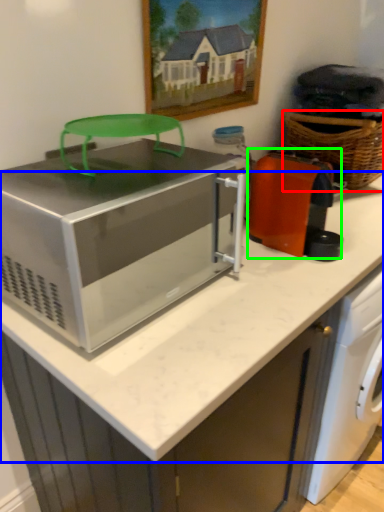
Question: Considering the real-world distances, which object is closest to basket (highlighted by a red box)? counter top (highlighted by a blue box) or appliance (highlighted by a green box).

Choices:
 (A) counter top
 (B) appliance

Answer: (B)